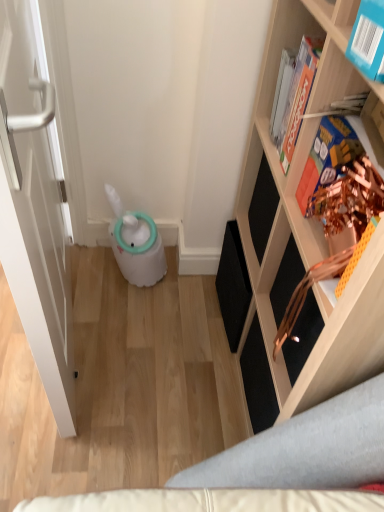
Where is `vacant area that lies to the right of white matte door at left`? The image size is (384, 512). vacant area that lies to the right of white matte door at left is located at coordinates 157,345.